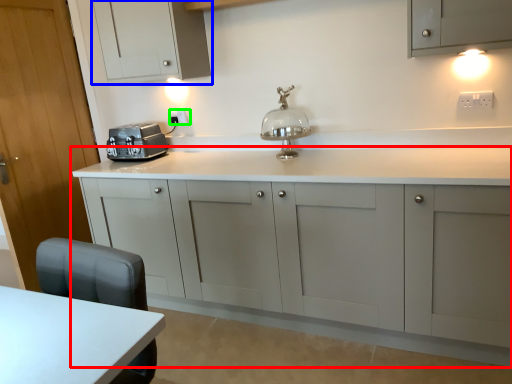
Question: Which object is positioned closest to cabinetry (highlighted by a red box)? Select from cabinetry (highlighted by a blue box) and electric outlet (highlighted by a green box).

Choices:
 (A) cabinetry
 (B) electric outlet

Answer: (A)